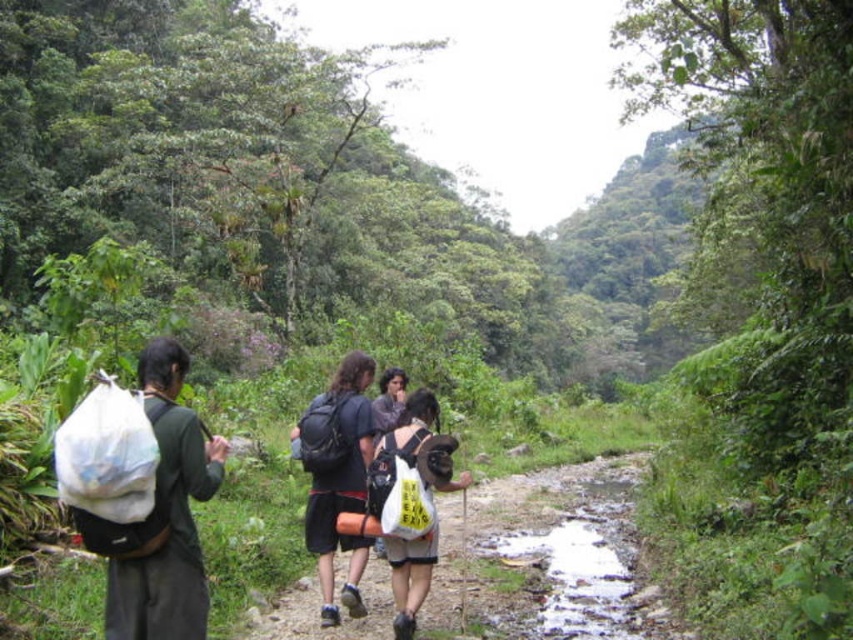
Question: Can you confirm if white fabric bag at left is positioned below black backpack at center?

Choices:
 (A) no
 (B) yes

Answer: (A)

Question: Does matte plastic bag at center appear on the left side of white fabric bag at center?

Choices:
 (A) no
 (B) yes

Answer: (A)

Question: Is matte plastic bag at center smaller than black backpack at center?

Choices:
 (A) no
 (B) yes

Answer: (A)

Question: Which object appears farthest from the camera in this image?

Choices:
 (A) matte plastic bag at center
 (B) black backpack at center

Answer: (B)

Question: Which point is farther to the camera?

Choices:
 (A) (445, 508)
 (B) (357, 355)

Answer: (A)

Question: Which object is the closest to the matte plastic bag at center?

Choices:
 (A) white fabric bag at center
 (B) white fabric bag at left
 (C) black backpack at center

Answer: (C)